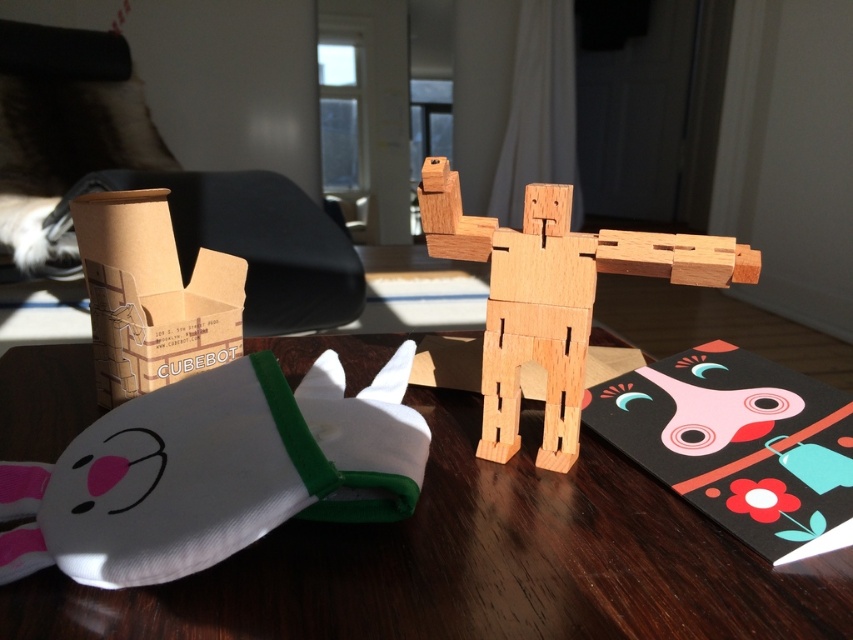
Is point (229, 605) positioned in front of point (119, 372)?

Yes.

Can you confirm if wooden table at center is smaller than brown cardboard box at left?

No, wooden table at center is not smaller than brown cardboard box at left.

Which is in front, point (550, 481) or point (241, 312)?

Positioned in front is point (550, 481).

The image size is (853, 640). Identify the location of wooden table at center. (474, 564).

Which is more to the left, white fabric plush at lower left or black matte card at right?

Positioned to the left is white fabric plush at lower left.

Can you confirm if white fabric plush at lower left is smaller than black matte card at right?

Actually, white fabric plush at lower left might be larger than black matte card at right.

Is point (361, 477) closer to viewer compared to point (799, 472)?

That is True.

Where is `white fabric plush at lower left`? The image size is (853, 640). white fabric plush at lower left is located at coordinates (213, 472).

Measure the distance between black matte card at right and camera.

black matte card at right and camera are 12.44 inches apart from each other.

Find the location of a particular element. This screenshot has height=640, width=853. black matte card at right is located at coordinates (735, 442).

Identify the location of black matte card at right. (735, 442).